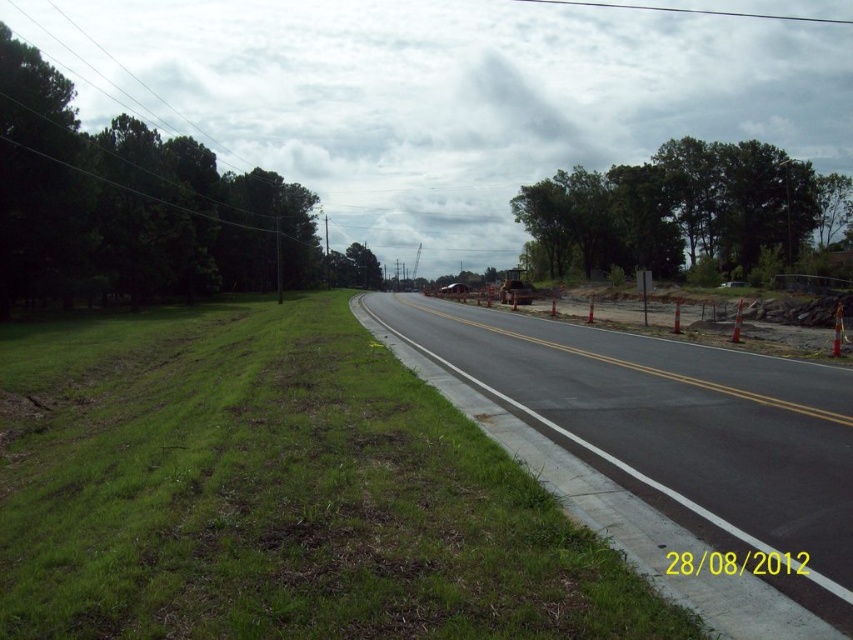
Question: Is green grass at lower left below asphalt road at center?

Choices:
 (A) yes
 (B) no

Answer: (A)

Question: Which point is closer to the camera?

Choices:
 (A) asphalt road at center
 (B) green grass at lower left

Answer: (B)

Question: Which point is closer to the camera?

Choices:
 (A) green grass at lower left
 (B) asphalt road at center

Answer: (A)

Question: Is green grass at lower left positioned in front of asphalt road at center?

Choices:
 (A) no
 (B) yes

Answer: (B)

Question: Does green grass at lower left have a larger size compared to asphalt road at center?

Choices:
 (A) yes
 (B) no

Answer: (A)